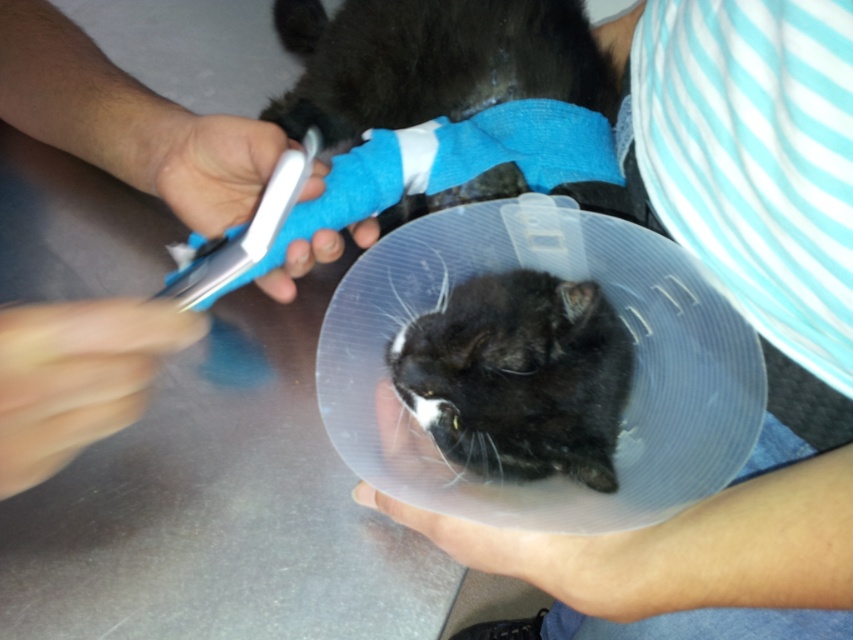
Which of these two, smooth blue bandage at upper center or black matte cone at center, stands taller?

smooth blue bandage at upper center

Can you confirm if smooth blue bandage at upper center is positioned below black matte cone at center?

Actually, smooth blue bandage at upper center is above black matte cone at center.

Which is in front, point (91, 422) or point (432, 396)?

Point (91, 422)

Identify the location of smooth blue bandage at upper center. This screenshot has height=640, width=853. (128, 122).

Can you confirm if blue striped shirt at upper right is taller than black matte cone at center?

Yes.

Can you confirm if blue striped shirt at upper right is positioned to the left of black matte cone at center?

In fact, blue striped shirt at upper right is to the right of black matte cone at center.

Measure the distance between blue striped shirt at upper right and camera.

15.53 inches

Image resolution: width=853 pixels, height=640 pixels. What are the coordinates of `blue striped shirt at upper right` in the screenshot? It's located at (750, 156).

Between blue striped shirt at upper right and smooth blue bandage at upper center, which one is positioned lower?

blue striped shirt at upper right is lower down.

Does blue striped shirt at upper right lie in front of smooth blue bandage at upper center?

That is False.

Which is behind, point (820, 458) or point (1, 422)?

The point (820, 458) is more distant.

Where is `blue striped shirt at upper right`? blue striped shirt at upper right is located at coordinates (750, 156).